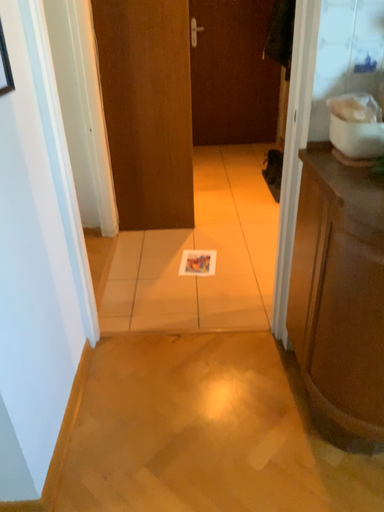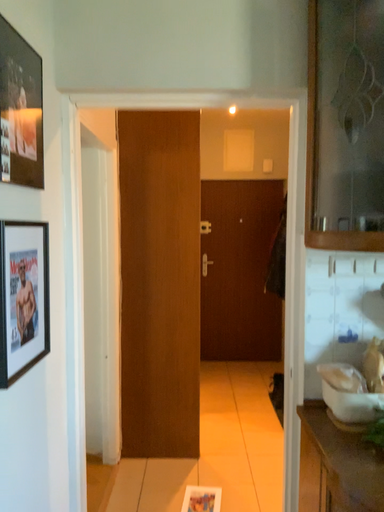
Question: Which way did the camera rotate in the video?

Choices:
 (A) rotated upward
 (B) rotated downward

Answer: (A)